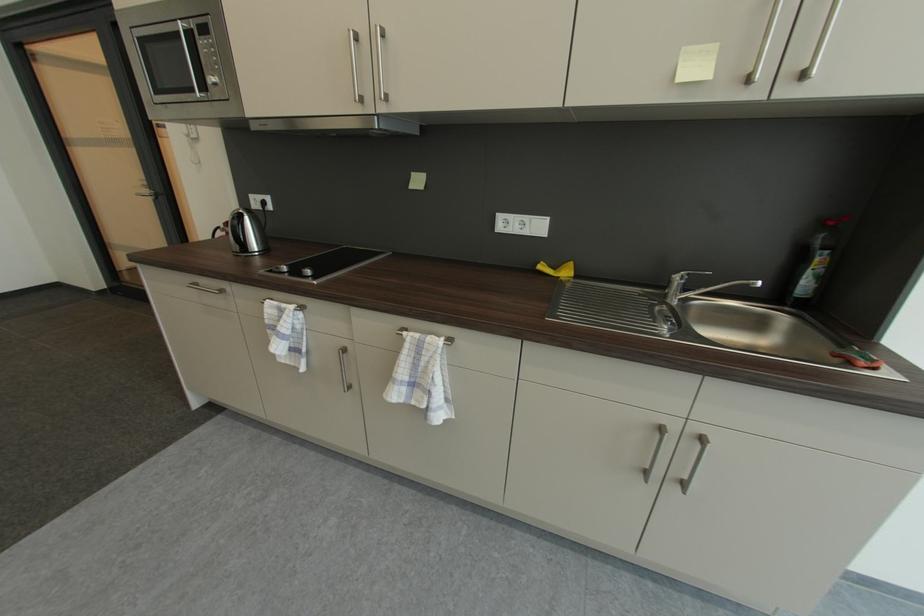
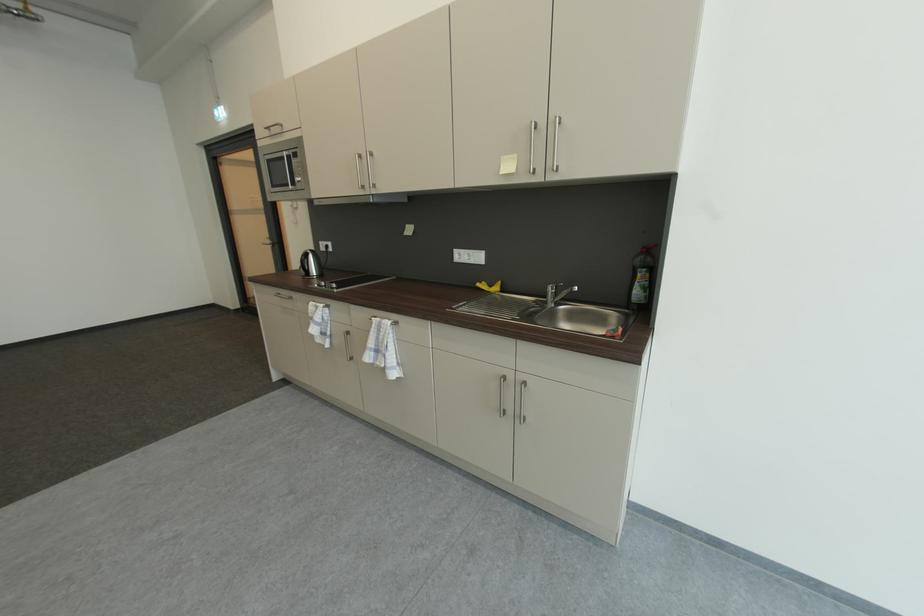
Which direction would the cameraman need to move to produce the second image?

The cameraman moved toward right, backward.